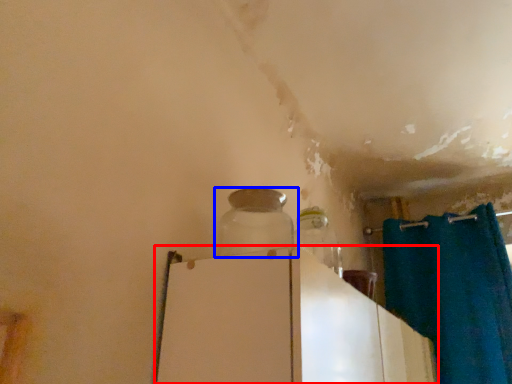
Question: Which object is closer to the camera taking this photo, appliance (highlighted by a red box) or bottle (highlighted by a blue box)?

Choices:
 (A) appliance
 (B) bottle

Answer: (A)